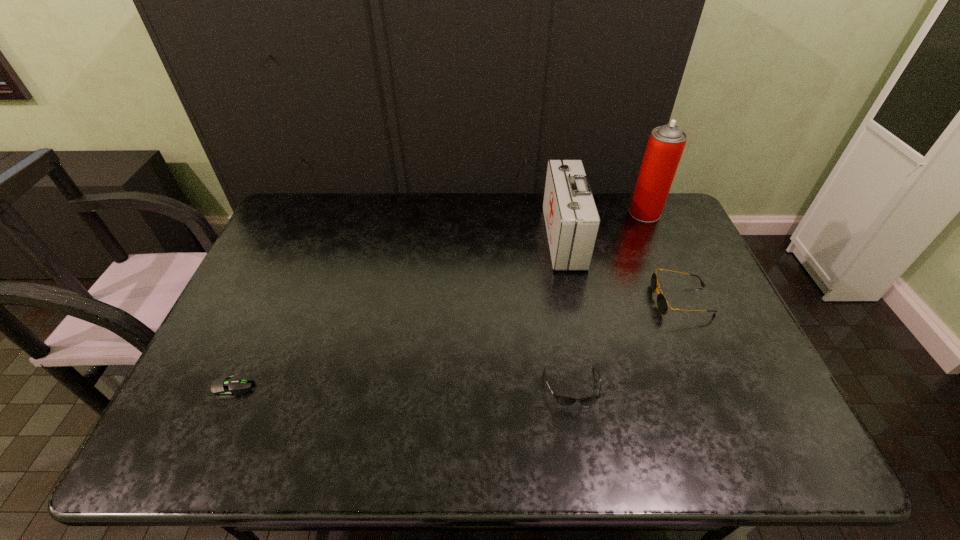
This screenshot has height=540, width=960. What are the coordinates of `aerosol can` in the screenshot? It's located at (666, 144).

The width and height of the screenshot is (960, 540). I want to click on the second tallest object, so click(572, 221).

Locate an element on the screen. the third nearest object is located at coordinates (662, 304).

Where is `the farther sunglasses`? the farther sunglasses is located at coordinates (662, 304).

I want to click on the shorter sunglasses, so click(x=563, y=400).

Identify the location of the second shortest object. Image resolution: width=960 pixels, height=540 pixels. (563, 400).

This screenshot has width=960, height=540. I want to click on computer mouse, so click(224, 387).

Locate an element on the screen. the leftmost object is located at coordinates (224, 387).

Where is `vacant space situated on the left of the aerosol can`? vacant space situated on the left of the aerosol can is located at coordinates (566, 213).

Where is `vacant space located on the front-facing side of the first-aid kit`? This screenshot has height=540, width=960. vacant space located on the front-facing side of the first-aid kit is located at coordinates (442, 238).